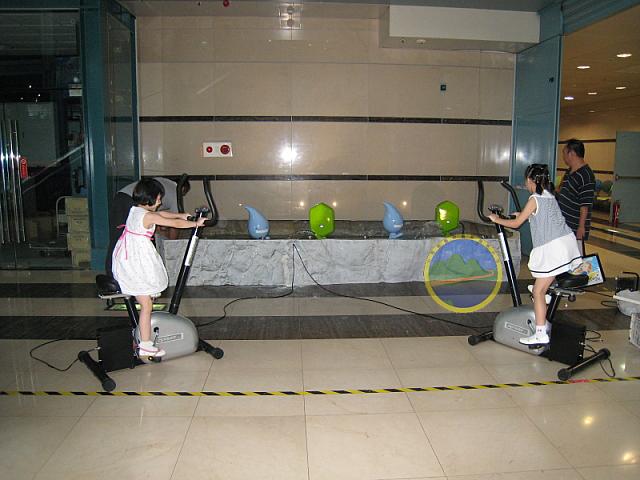
Find the location of a particular element. The height and width of the screenshot is (480, 640). ceiling is located at coordinates (595, 44).